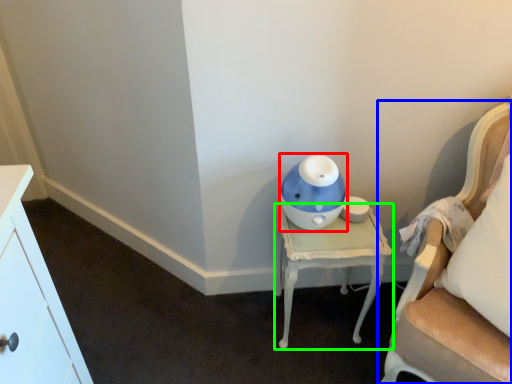
Question: Which is farther away from toy (highlighted by a red box)? chair (highlighted by a blue box) or nightstand (highlighted by a green box)?

Choices:
 (A) chair
 (B) nightstand

Answer: (A)